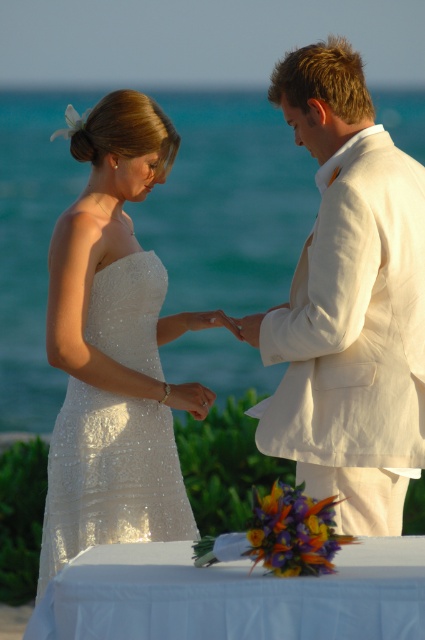
Question: Can you confirm if white linen suit at center is bigger than silver metallic ring at center?

Choices:
 (A) no
 (B) yes

Answer: (B)

Question: Can you confirm if white linen suit at center is positioned to the left of white sequined dress at left?

Choices:
 (A) no
 (B) yes

Answer: (A)

Question: Does white linen suit at center come behind silver metallic ring at center?

Choices:
 (A) yes
 (B) no

Answer: (B)

Question: Which of the following is the closest to the observer?

Choices:
 (A) white linen suit at center
 (B) silver metallic ring at center

Answer: (A)

Question: Which object appears farthest from the camera in this image?

Choices:
 (A) white sequined dress at left
 (B) white linen suit at center
 (C) silver metallic ring at center

Answer: (C)

Question: Which object appears closest to the camera in this image?

Choices:
 (A) white linen suit at center
 (B) silver metallic ring at center

Answer: (A)